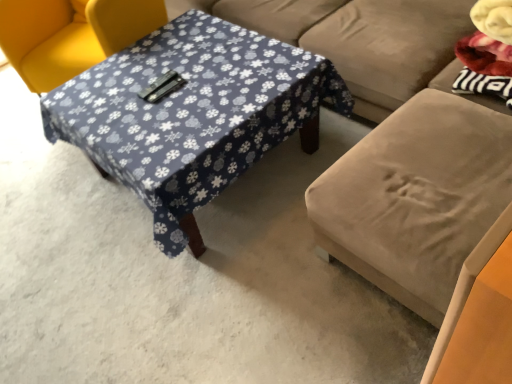
Question: Is velvet beige studio couch at center thinner than yellow fabric chair at upper left?

Choices:
 (A) no
 (B) yes

Answer: (A)

Question: From a real-world perspective, is velvet beige studio couch at center physically above yellow fabric chair at upper left?

Choices:
 (A) yes
 (B) no

Answer: (A)

Question: Can you confirm if velvet beige studio couch at center is shorter than yellow fabric chair at upper left?

Choices:
 (A) yes
 (B) no

Answer: (B)

Question: Can you confirm if velvet beige studio couch at center is bigger than yellow fabric chair at upper left?

Choices:
 (A) no
 (B) yes

Answer: (B)

Question: Is velvet beige studio couch at center completely or partially outside of yellow fabric chair at upper left?

Choices:
 (A) no
 (B) yes

Answer: (B)

Question: Is blue fabric-covered table at center bigger or smaller than yellow fabric chair at upper left?

Choices:
 (A) small
 (B) big

Answer: (A)

Question: Considering the positions of point (267, 52) and point (10, 9), is point (267, 52) closer or farther from the camera than point (10, 9)?

Choices:
 (A) farther
 (B) closer

Answer: (B)

Question: In the image, is blue fabric-covered table at center positioned in front of or behind yellow fabric chair at upper left?

Choices:
 (A) front
 (B) behind

Answer: (A)

Question: From the image's perspective, is blue fabric-covered table at center above or below yellow fabric chair at upper left?

Choices:
 (A) above
 (B) below

Answer: (B)

Question: Is point (258, 99) closer or farther from the camera than point (379, 148)?

Choices:
 (A) farther
 (B) closer

Answer: (A)

Question: Is blue fabric-covered table at center bigger or smaller than velvet beige studio couch at center?

Choices:
 (A) small
 (B) big

Answer: (A)

Question: Considering the positions of blue fabric-covered table at center and velvet beige studio couch at center in the image, is blue fabric-covered table at center taller or shorter than velvet beige studio couch at center?

Choices:
 (A) tall
 (B) short

Answer: (B)

Question: Is blue fabric-covered table at center wider or thinner than velvet beige studio couch at center?

Choices:
 (A) thin
 (B) wide

Answer: (A)

Question: Choose the correct answer: Is yellow fabric chair at upper left inside blue fabric-covered table at center or outside it?

Choices:
 (A) outside
 (B) inside

Answer: (A)

Question: Is yellow fabric chair at upper left bigger or smaller than blue fabric-covered table at center?

Choices:
 (A) big
 (B) small

Answer: (A)